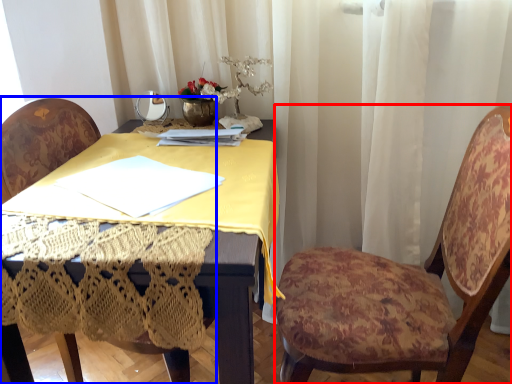
Question: Which object is further to the camera taking this photo, chair (highlighted by a red box) or chair (highlighted by a blue box)?

Choices:
 (A) chair
 (B) chair

Answer: (B)